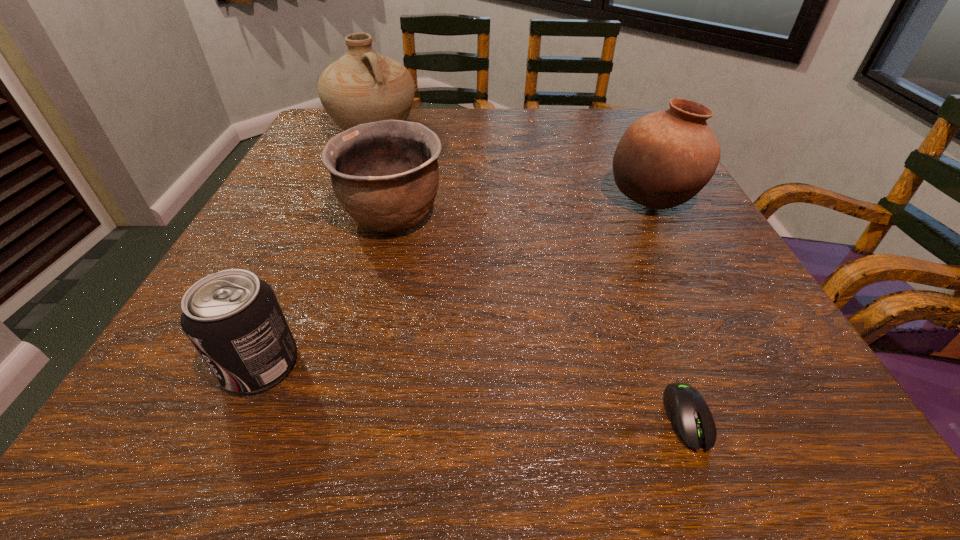
Image resolution: width=960 pixels, height=540 pixels. Find the location of `soda can situated at the near edge`. soda can situated at the near edge is located at coordinates (233, 319).

Identify the location of computer mouse that is at the near edge. Image resolution: width=960 pixels, height=540 pixels. (688, 412).

Find the location of `pottery that is positioned at the left edge`. pottery that is positioned at the left edge is located at coordinates (363, 86).

Find the location of `soda can that is positioned at the left edge`. soda can that is positioned at the left edge is located at coordinates (233, 319).

Where is `pottery located in the right edge section of the desktop`? The height and width of the screenshot is (540, 960). pottery located in the right edge section of the desktop is located at coordinates (665, 158).

Where is `computer mouse at the right edge`? computer mouse at the right edge is located at coordinates (688, 412).

Identify the location of object present at the far left corner. (363, 86).

This screenshot has height=540, width=960. Find the location of `object that is at the near left corner`. object that is at the near left corner is located at coordinates (233, 319).

Identify the location of object situated at the near right corner. This screenshot has height=540, width=960. (688, 412).

Image resolution: width=960 pixels, height=540 pixels. I want to click on blank space at the far edge of the desktop, so click(x=451, y=122).